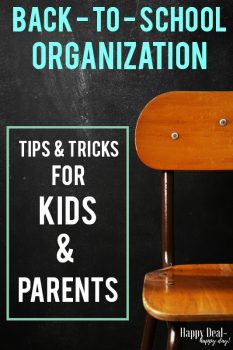
At what (x,y) coordinates should I click in order to perform the action: click on chair. Please return your answer as a coordinate pair (x, y). The height and width of the screenshot is (350, 233). Looking at the image, I should click on (183, 308).